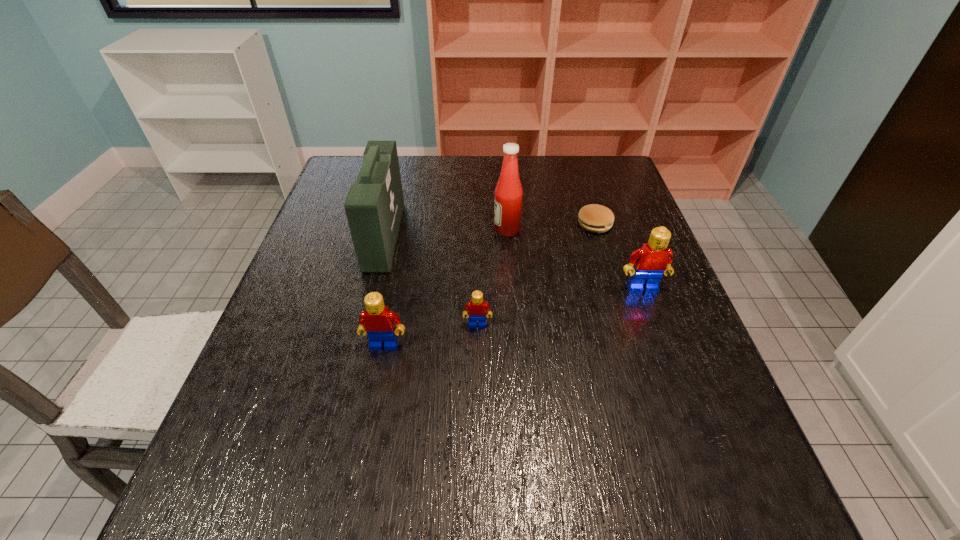
Where is `free space between the first-aid kit and the third object from right to left`? Image resolution: width=960 pixels, height=540 pixels. free space between the first-aid kit and the third object from right to left is located at coordinates pos(445,233).

I want to click on free space between the second Lego from right to left and the patty, so click(536, 274).

I want to click on free space between the condiment and the second shortest object, so click(x=492, y=278).

Locate an element on the screen. The height and width of the screenshot is (540, 960). object that stands as the fifth closest to the condiment is located at coordinates (377, 321).

At what (x,y) coordinates should I click in order to perform the action: click on the closest object to the second shortest object. Please return your answer as a coordinate pair (x, y). The height and width of the screenshot is (540, 960). Looking at the image, I should click on (377, 321).

Locate which Lego ranks second in proximity to the third object from left to right. Please provide its 2D coordinates. Your answer should be formatted as a tuple, i.e. [(x, y)], where the tuple contains the x and y coordinates of a point satisfying the conditions above.

[(651, 261)]

Choose which Lego is the second nearest neighbor to the third shortest object. Please provide its 2D coordinates. Your answer should be formatted as a tuple, i.e. [(x, y)], where the tuple contains the x and y coordinates of a point satisfying the conditions above.

[(651, 261)]

Where is `free space that satisfies the following two spatial constraints: 1. on the front-facing side of the condiment; 2. on the front-facing side of the fifth farthest object`? free space that satisfies the following two spatial constraints: 1. on the front-facing side of the condiment; 2. on the front-facing side of the fifth farthest object is located at coordinates (514, 325).